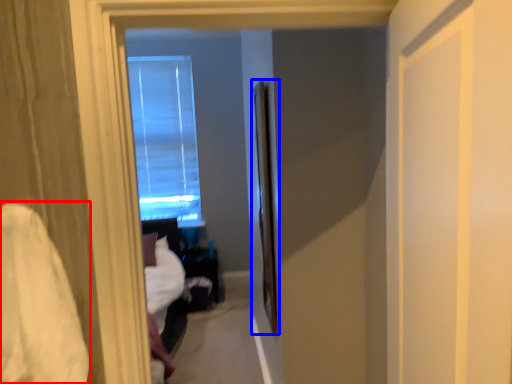
Question: Which point is closer to the camera, sheet (highlighted by a red box) or screen door (highlighted by a blue box)?

Choices:
 (A) sheet
 (B) screen door

Answer: (A)